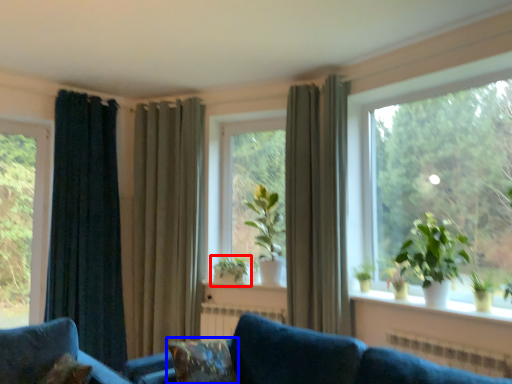
Question: Which of the following is the closest to the observer, houseplant (highlighted by a red box) or pillow (highlighted by a blue box)?

Choices:
 (A) houseplant
 (B) pillow

Answer: (B)